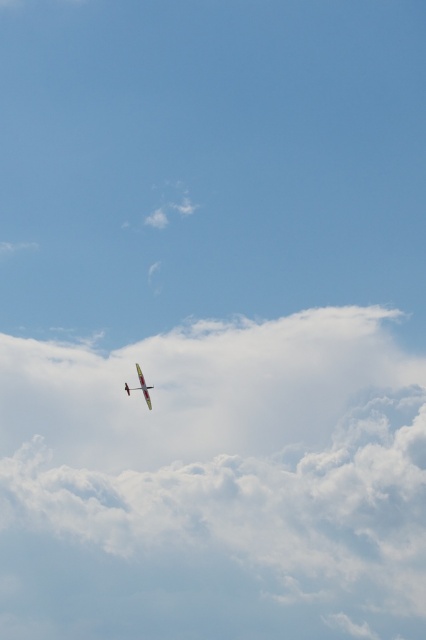
Does white fluffy cloud at upper center appear on the left side of metallic silver airplane at center?

In fact, white fluffy cloud at upper center is to the right of metallic silver airplane at center.

Between point (253, 428) and point (129, 394), which one is positioned in front?

Positioned in front is point (253, 428).

This screenshot has width=426, height=640. In order to click on white fluffy cloud at upper center in this screenshot , I will do `click(215, 483)`.